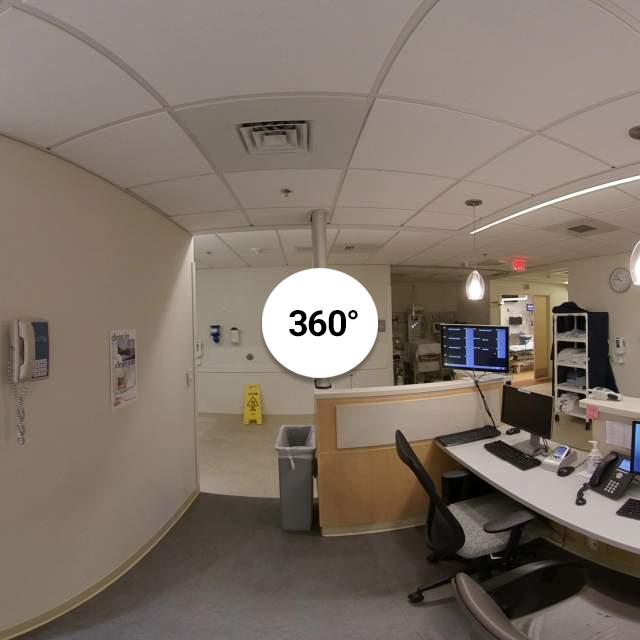
Identify the location of wall clock. This screenshot has height=640, width=640. (618, 281).